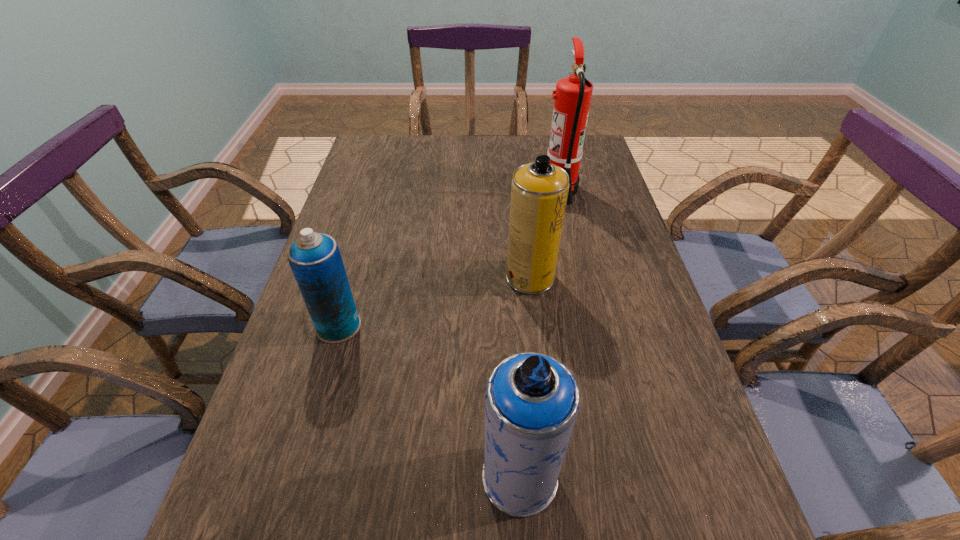
Where is `vacant space that satisfies the following two spatial constraints: 1. at the nozzle of the farthest object; 2. on the front side of the nearest aerosol can`? vacant space that satisfies the following two spatial constraints: 1. at the nozzle of the farthest object; 2. on the front side of the nearest aerosol can is located at coordinates (625, 477).

Locate an element on the screen. Image resolution: width=960 pixels, height=540 pixels. vacant region that satisfies the following two spatial constraints: 1. at the nozzle of the rightmost object; 2. on the front side of the shortest object is located at coordinates (591, 326).

I want to click on vacant region that satisfies the following two spatial constraints: 1. at the nozzle of the tallest object; 2. on the front side of the shortest aerosol can, so click(591, 326).